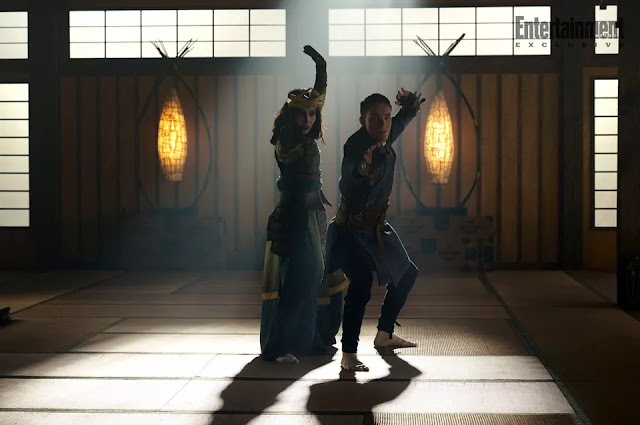
Identify the location of lamp frame. The image size is (640, 425). (445, 210), (184, 213).